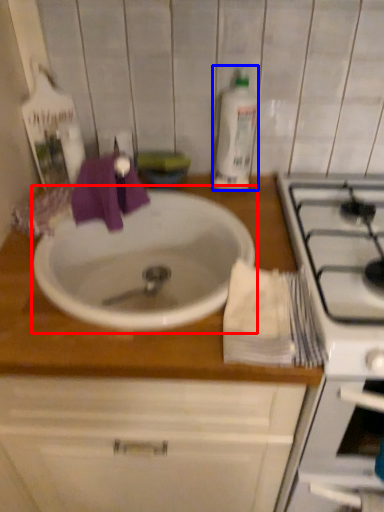
Question: Which of the following is the farthest to the observer, sink (highlighted by a red box) or cleaning product (highlighted by a blue box)?

Choices:
 (A) sink
 (B) cleaning product

Answer: (B)